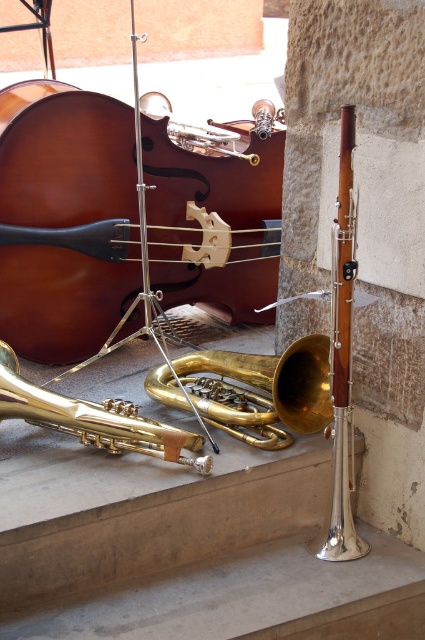
You are a musician who needs to pick up both the gold shiny trumpet at center and the gold brass trumpet at center. Which one should you pick up first if you want to reach the lower one first?

The gold shiny trumpet at center is located below the gold brass trumpet at center, so you should pick up the gold shiny trumpet at center first.

You are standing at the origin point in the image. Which direction should you move to reach the gold shiny trumpet at center?

The gold shiny trumpet at center is located at point (261,388) in 2D coordinates, so you should move northeast to reach it.

You are a musician who wants to place a new instrument case between the matte brown cello at center and the gold shiny trumpet at lower left. Based on their positions, which side of the trumpet should you place the case to ensure it stays between them?

The matte brown cello at center is to the right of the gold shiny trumpet at lower left. To place the case between them, position it to the right of the gold shiny trumpet at lower left, towards the cello.